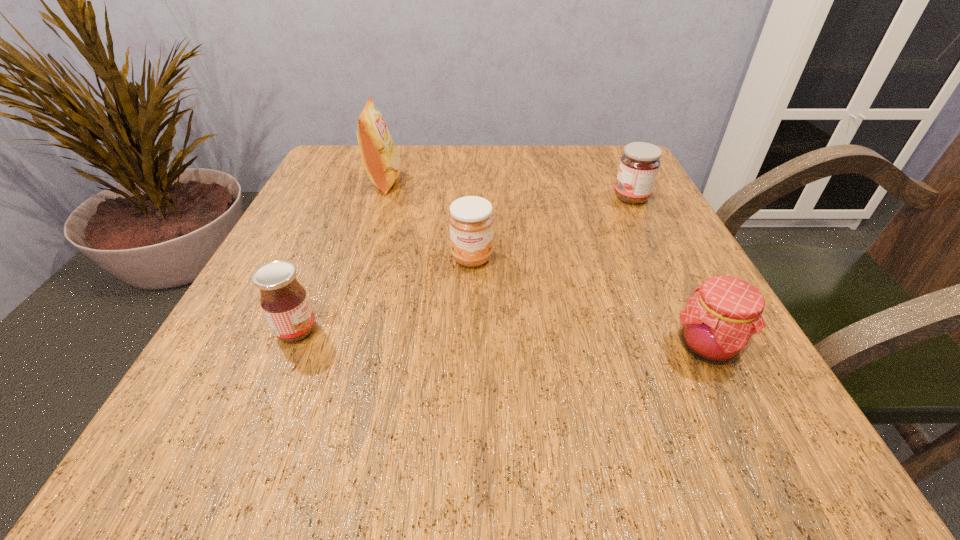
At what (x,y) coordinates should I click in order to perform the action: click on vacant space that is in between the farthest jam and the tallest object. Please return your answer as a coordinate pair (x, y). Looking at the image, I should click on [x=508, y=190].

You are a GUI agent. You are given a task and a screenshot of the screen. Output one action in this format:
    pyautogui.click(x=<x>, y=<y>)
    Task: Click on the empty space between the tallest object and the farthest jam
    Image resolution: width=960 pixels, height=540 pixels.
    Given the screenshot: What is the action you would take?
    pyautogui.click(x=508, y=190)

At what (x,y) coordinates should I click in order to perform the action: click on free space between the third jam from right to left and the tallest object. Please return your answer as a coordinate pair (x, y). The height and width of the screenshot is (540, 960). Looking at the image, I should click on (428, 220).

The width and height of the screenshot is (960, 540). Find the location of `empty location between the crisp (potato chip) and the leftmost jam`. empty location between the crisp (potato chip) and the leftmost jam is located at coordinates (341, 256).

Locate an element on the screen. The width and height of the screenshot is (960, 540). vacant area that lies between the tallest object and the leftmost jam is located at coordinates (341, 256).

Where is `object that ranks as the fourth closest to the tallest object`? object that ranks as the fourth closest to the tallest object is located at coordinates tap(721, 319).

Point out which object is positioned as the nearest to the third farthest object. Please provide its 2D coordinates. Your answer should be formatted as a tuple, i.e. [(x, y)], where the tuple contains the x and y coordinates of a point satisfying the conditions above.

[(382, 163)]

Select which jam is the closest to the third jam from right to left. Please provide its 2D coordinates. Your answer should be formatted as a tuple, i.e. [(x, y)], where the tuple contains the x and y coordinates of a point satisfying the conditions above.

[(284, 301)]

The height and width of the screenshot is (540, 960). Identify the location of jam that can be found as the second closest to the leftmost jam. (721, 319).

Identify the location of free location that satisfies the following two spatial constraints: 1. on the front label of the second farthest jam; 2. on the label side of the leftmost jam. Image resolution: width=960 pixels, height=540 pixels. pos(470,330).